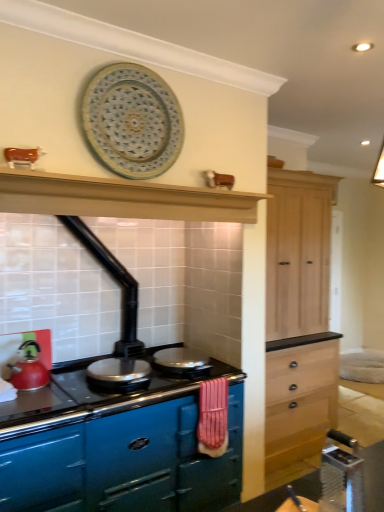
Where is `free location in front of matte red kettle at left`? Image resolution: width=384 pixels, height=512 pixels. free location in front of matte red kettle at left is located at coordinates (32, 399).